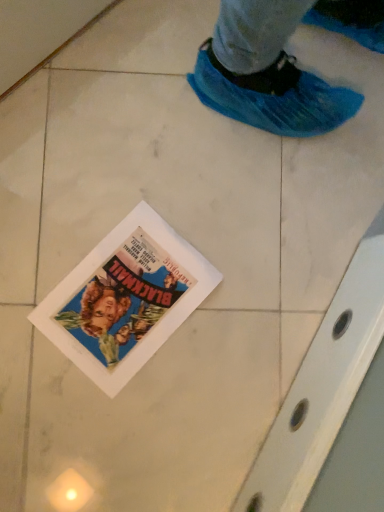
You are a GUI agent. You are given a task and a screenshot of the screen. Output one action in this format:
    pyautogui.click(x=<x>, y=<y>)
    Task: Click on the free space to the back side of white paper at center
    
    Given the screenshot: What is the action you would take?
    pyautogui.click(x=183, y=177)